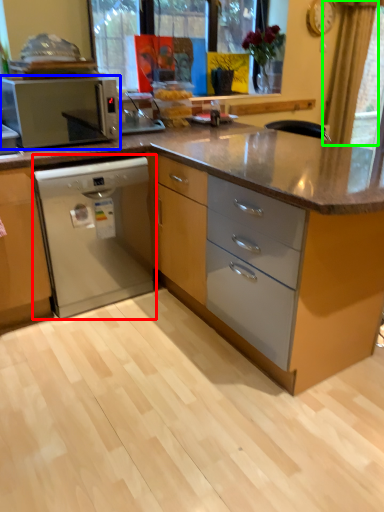
Question: Based on their relative distances, which object is farther from home appliance (highlighted by a red box)? Choose from kitchen appliance (highlighted by a blue box) and curtain (highlighted by a green box).

Choices:
 (A) kitchen appliance
 (B) curtain

Answer: (B)